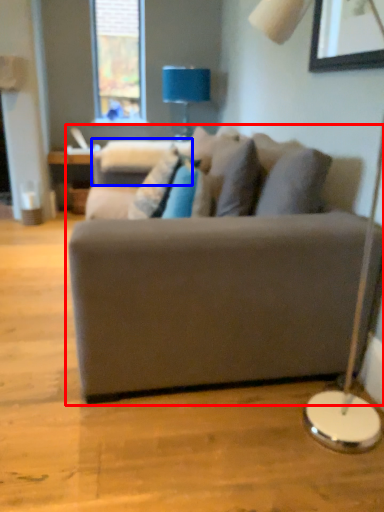
Question: Which object is further to the camera taking this photo, studio couch (highlighted by a red box) or swivel chair (highlighted by a blue box)?

Choices:
 (A) studio couch
 (B) swivel chair

Answer: (B)